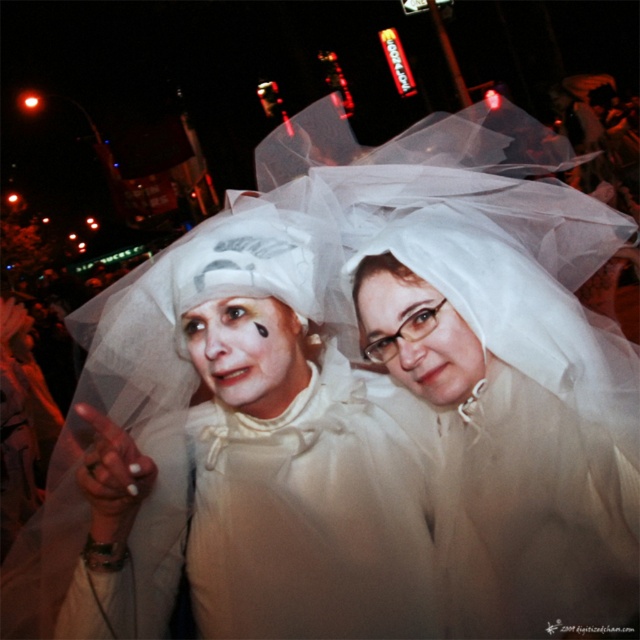
From the picture: You are a photographer standing at a certain distance from the white sheer veil at center. If you want to capture a closeup shot of the veil without moving your camera, what adjustment should you make?

You should zoom in on the white sheer veil at center since it is 89.44 centimeters away from the viewer, which allows for adjusting the focal length to bring the veil into closer focus without moving the camera.

You are a photographer who wants to ensure both veils are visible in the photo. Given that the white sheer veil at center is much taller than the translucent white veil at center, which veil might be more likely to block the other from view?

The white sheer veil at center is much taller than the translucent white veil at center, so it might block the view of the translucent white veil at center.

You are a photographer trying to capture both veils in a single frame. Given that the white sheer veil at center is wider than the translucent white veil at center, which veil should you focus on to ensure both fit in the frame without cropping?

The white sheer veil at center is wider than the translucent white veil at center, so you should focus on the white sheer veil at center to ensure both fit in the frame without cropping.